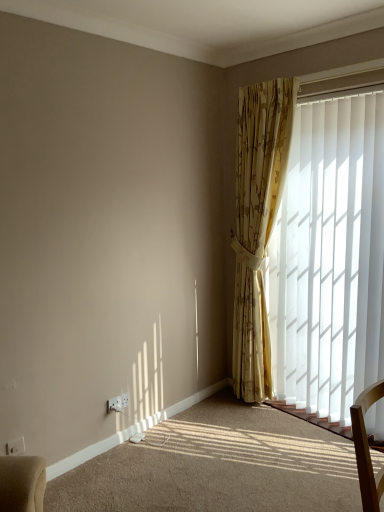
Question: Can you confirm if white vertical blinds at right is positioned to the right of white plastic window frame at upper right?

Choices:
 (A) yes
 (B) no

Answer: (B)

Question: From the image's perspective, is white vertical blinds at right beneath white plastic window frame at upper right?

Choices:
 (A) no
 (B) yes

Answer: (B)

Question: Can you confirm if white vertical blinds at right is taller than white plastic window frame at upper right?

Choices:
 (A) yes
 (B) no

Answer: (A)

Question: Does white vertical blinds at right have a lesser height compared to white plastic window frame at upper right?

Choices:
 (A) no
 (B) yes

Answer: (A)

Question: From a real-world perspective, is white vertical blinds at right below white plastic window frame at upper right?

Choices:
 (A) yes
 (B) no

Answer: (A)

Question: Does point (372, 83) appear closer or farther from the camera than point (261, 150)?

Choices:
 (A) closer
 (B) farther

Answer: (A)

Question: In terms of size, does white plastic window frame at upper right appear bigger or smaller than gold floral curtain at right?

Choices:
 (A) small
 (B) big

Answer: (A)

Question: Considering the positions of white plastic window frame at upper right and gold floral curtain at right in the image, is white plastic window frame at upper right taller or shorter than gold floral curtain at right?

Choices:
 (A) short
 (B) tall

Answer: (A)

Question: Is white plastic window frame at upper right inside or outside of gold floral curtain at right?

Choices:
 (A) inside
 (B) outside

Answer: (B)

Question: In terms of height, does white plastic electric outlet at lower left, the 2th electric outlet from the back, look taller or shorter compared to white vertical blinds at right?

Choices:
 (A) short
 (B) tall

Answer: (A)

Question: From a real-world perspective, is white plastic electric outlet at lower left, the 2th electric outlet from the back, positioned above or below white vertical blinds at right?

Choices:
 (A) below
 (B) above

Answer: (A)

Question: Is white plastic electric outlet at lower left, placed as the first electric outlet when sorted from front to back, wider or thinner than white vertical blinds at right?

Choices:
 (A) wide
 (B) thin

Answer: (B)

Question: Choose the correct answer: Is white plastic electric outlet at lower left, arranged as the 1th electric outlet when viewed from the left, inside white vertical blinds at right or outside it?

Choices:
 (A) outside
 (B) inside

Answer: (A)

Question: From the image's perspective, relative to white plastic window frame at upper right, is white plastic electric outlet at lower left, marked as the 1th electric outlet in a right-to-left arrangement, above or below?

Choices:
 (A) below
 (B) above

Answer: (A)

Question: Is point (117, 411) closer or farther from the camera than point (317, 84)?

Choices:
 (A) closer
 (B) farther

Answer: (B)